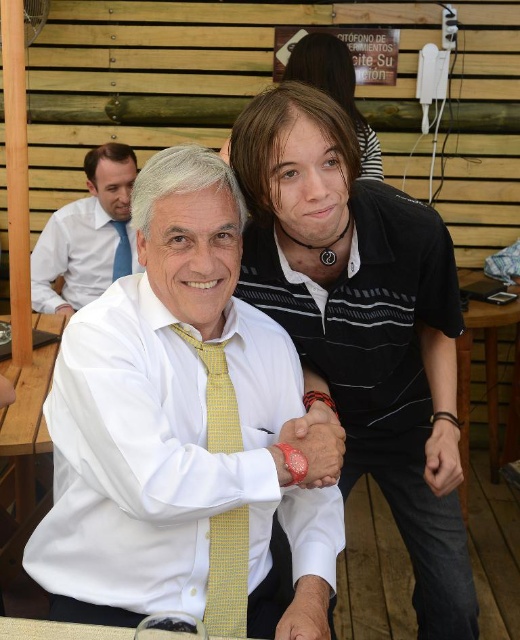
In the scene shown: What are the coordinates of the white matte shirt at center?

The white matte shirt at center is located at coordinates point (180,428).

You are a photographer standing in the room and want to take a photo of both the black striped polo shirt at center and the white shirt at upper left. Which one should you focus on first if you want to capture both in the frame without moving the camera?

The black striped polo shirt at center is positioned on the right side of white shirt at upper left, so you should focus on the white shirt at upper left first to ensure both are in the frame.

You are a fashion designer observing two individuals in a casual indoor setting. You notice the black striped polo shirt at center and the white shirt at upper left. Which of these two shirts has a greater width?

The black striped polo shirt at center has a greater width than the white shirt at upper left according to the description.